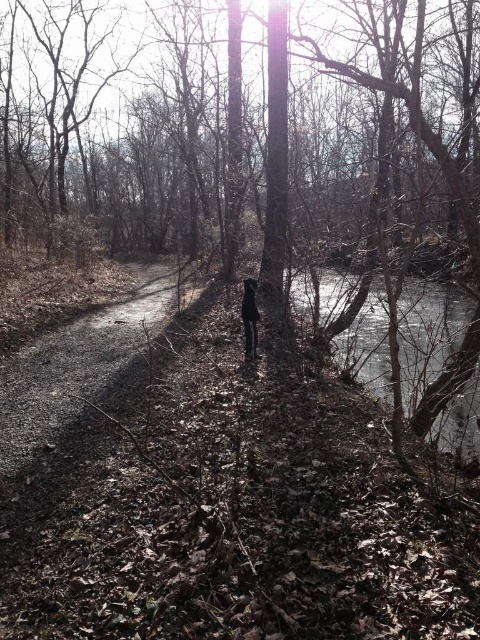
Question: Does clear water at right appear over black leather pants at center?

Choices:
 (A) no
 (B) yes

Answer: (B)

Question: Among these points, which one is nearest to the camera?

Choices:
 (A) (465, 442)
 (B) (243, 326)

Answer: (A)

Question: Can you confirm if clear water at right is wider than black leather pants at center?

Choices:
 (A) no
 (B) yes

Answer: (B)

Question: Which object is closer to the camera taking this photo?

Choices:
 (A) black leather pants at center
 (B) clear water at right

Answer: (B)

Question: Does clear water at right appear under black leather pants at center?

Choices:
 (A) no
 (B) yes

Answer: (A)